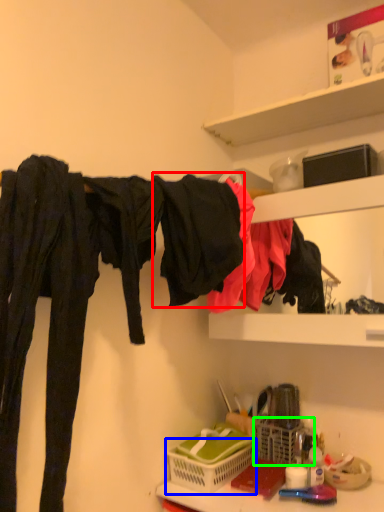
Question: Which is farther away from clothing (highlighted by a red box)? basket (highlighted by a blue box) or basket (highlighted by a green box)?

Choices:
 (A) basket
 (B) basket

Answer: (B)